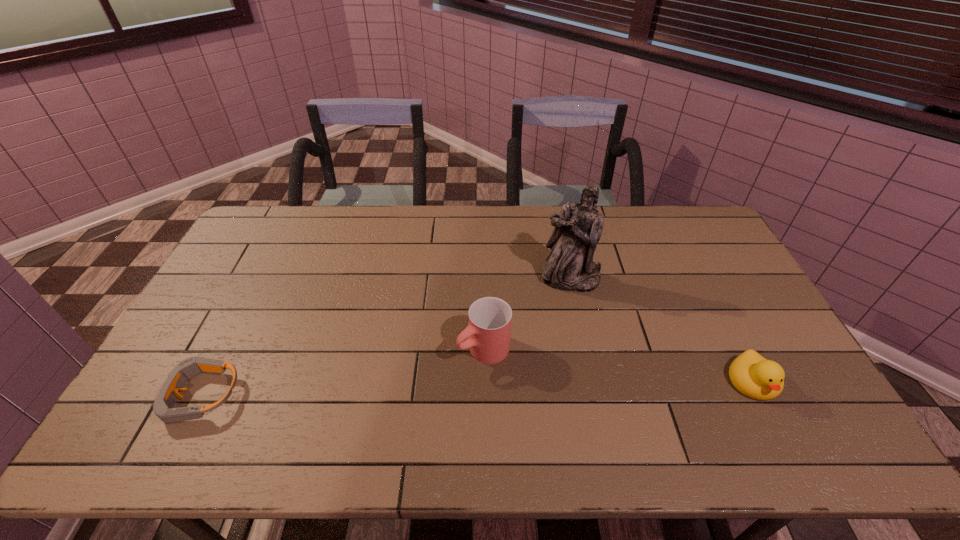
Where is `empty space between the second object from right to left and the goggles`? Image resolution: width=960 pixels, height=540 pixels. empty space between the second object from right to left and the goggles is located at coordinates (386, 338).

Locate an element on the screen. vacant space that's between the second object from left to right and the rightmost object is located at coordinates (618, 366).

Find the location of a particular element. The height and width of the screenshot is (540, 960). unoccupied area between the cup and the farthest object is located at coordinates (527, 314).

Locate an element on the screen. unoccupied area between the rightmost object and the goggles is located at coordinates (477, 389).

The width and height of the screenshot is (960, 540). I want to click on vacant area between the leftmost object and the cup, so click(x=342, y=373).

You are a GUI agent. You are given a task and a screenshot of the screen. Output one action in this format:
    pyautogui.click(x=<x>, y=<y>)
    Task: Click on the object that stands as the second closest to the farthest object
    The width and height of the screenshot is (960, 540).
    Given the screenshot: What is the action you would take?
    pyautogui.click(x=754, y=376)

At what (x,y) coordinates should I click in order to perform the action: click on object that is the third closest to the leftmost object. Please return your answer as a coordinate pair (x, y). Looking at the image, I should click on (x=754, y=376).

Identify the location of free region that satisfies the following two spatial constraints: 1. on the back side of the figurine; 2. on the left side of the second tallest object. The image size is (960, 540). (483, 279).